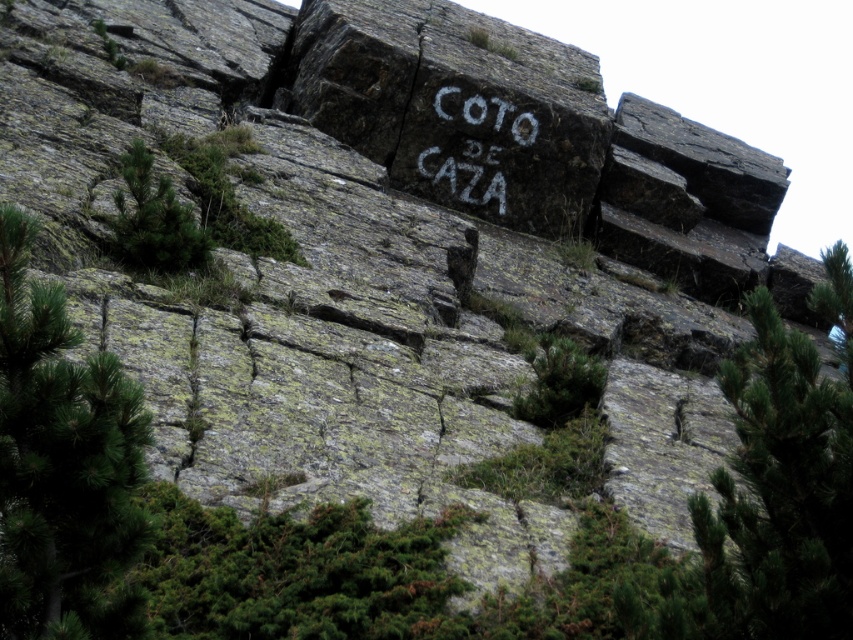
Question: Among these objects, which one is nearest to the camera?

Choices:
 (A) white chalk writing at center
 (B) green leafy tree at lower left
 (C) green leafy tree at left
 (D) green textured pine tree at center

Answer: (B)

Question: Is green textured pine tree at center to the right of white chalk writing at center from the viewer's perspective?

Choices:
 (A) yes
 (B) no

Answer: (A)

Question: Based on their relative distances, which object is farther from the green textured pine tree at center?

Choices:
 (A) green leafy tree at lower left
 (B) green leafy tree at left

Answer: (B)

Question: From the image, what is the correct spatial relationship of green leafy tree at lower left in relation to green leafy tree at left?

Choices:
 (A) left
 (B) right

Answer: (B)

Question: Is white chalk writing at center wider than green leafy tree at left?

Choices:
 (A) yes
 (B) no

Answer: (A)

Question: Which object is closer to the camera taking this photo?

Choices:
 (A) green textured pine tree at center
 (B) white chalk writing at center
 (C) green leafy tree at lower left
 (D) green leafy tree at left

Answer: (C)